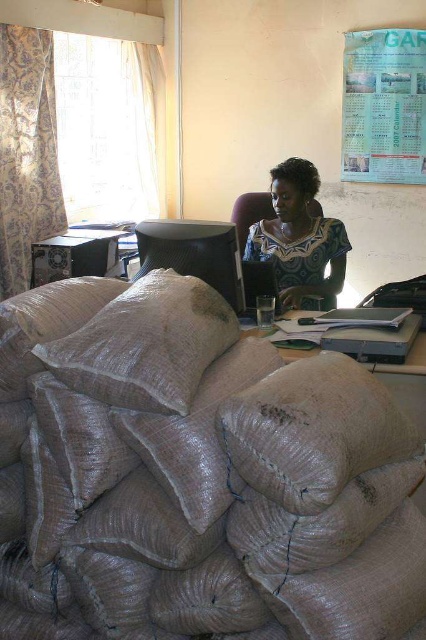
Is blue printed blouse at center below matte plastic table at center?

No.

Can you confirm if blue printed blouse at center is shorter than matte plastic table at center?

No.

This screenshot has height=640, width=426. Describe the element at coordinates (299, 237) in the screenshot. I see `blue printed blouse at center` at that location.

Identify the location of blue printed blouse at center. The image size is (426, 640). (299, 237).

Who is shorter, worn canvas pillow at lower left or blue printed blouse at center?

With less height is worn canvas pillow at lower left.

Does worn canvas pillow at lower left have a greater height compared to blue printed blouse at center?

No, worn canvas pillow at lower left is not taller than blue printed blouse at center.

Between point (167, 280) and point (313, 184), which one is positioned in front?

Point (167, 280)

At what (x,y) coordinates should I click in order to perform the action: click on worn canvas pillow at lower left. Please return your answer as a coordinate pair (x, y). Image resolution: width=426 pixels, height=640 pixels. Looking at the image, I should click on (146, 344).

Does burlap sack at lower center lie behind paperboard calendar at upper right?

No, burlap sack at lower center is closer to the viewer.

The width and height of the screenshot is (426, 640). I want to click on burlap sack at lower center, so click(313, 429).